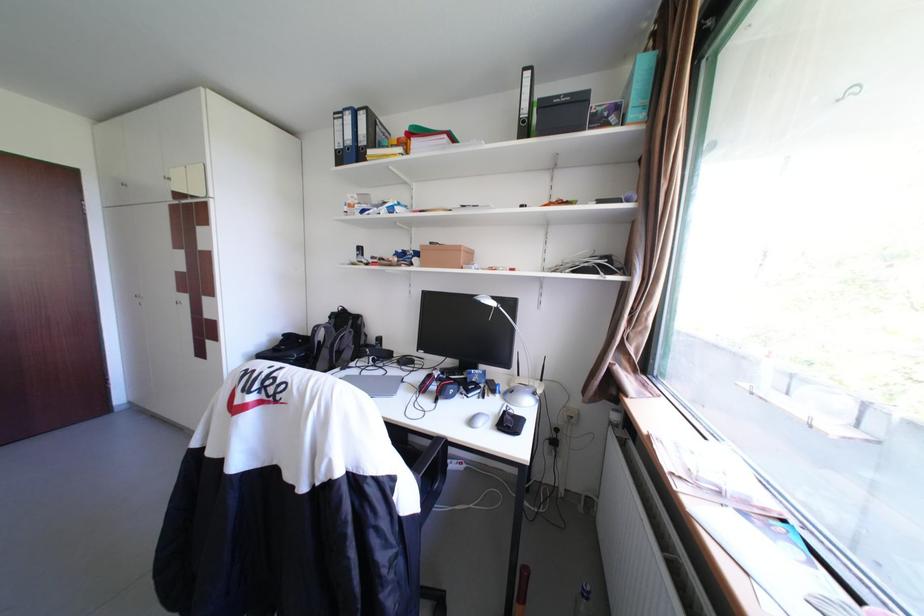
Find where to lift the plastic water bottle. Please return your answer as a coordinate pair (x, y).

(582, 601)